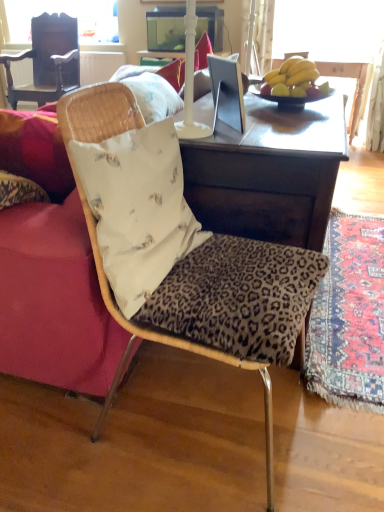
This screenshot has width=384, height=512. In order to click on leopard print fabric chair at center, the 2th chair viewed from the back in this screenshot , I will do `click(98, 243)`.

What is the approximate width of yellow matte bananas at upper right?

10.57 inches.

Where is `leopard print fabric chair at center, which ranks as the 2th chair in top-to-bottom order`? The width and height of the screenshot is (384, 512). leopard print fabric chair at center, which ranks as the 2th chair in top-to-bottom order is located at coordinates (98, 243).

Measure the distance from velvet red couch at left to leopard print fabric chair at center, which ranks as the first chair in right-to-left order.

velvet red couch at left and leopard print fabric chair at center, which ranks as the first chair in right-to-left order, are 9.75 inches apart.

Does velvet red couch at left come in front of leopard print fabric chair at center, which ranks as the 2th chair in top-to-bottom order?

No, the depth of velvet red couch at left is greater than that of leopard print fabric chair at center, which ranks as the 2th chair in top-to-bottom order.

Considering the sizes of objects velvet red couch at left and leopard print fabric chair at center, arranged as the 1th chair when viewed from the front, in the image provided, who is shorter, velvet red couch at left or leopard print fabric chair at center, arranged as the 1th chair when viewed from the front,?

With less height is velvet red couch at left.

Consider the image. Measure the distance between velvet red couch at left and carpet with intricate patterns at lower right.

velvet red couch at left and carpet with intricate patterns at lower right are 35.40 inches apart.

Is velvet red couch at left to the left of carpet with intricate patterns at lower right from the viewer's perspective?

Correct, you'll find velvet red couch at left to the left of carpet with intricate patterns at lower right.

Can you confirm if velvet red couch at left is wider than carpet with intricate patterns at lower right?

Yes.

Is velvet red couch at left oriented towards carpet with intricate patterns at lower right?

No, velvet red couch at left is not aimed at carpet with intricate patterns at lower right.

This screenshot has width=384, height=512. I want to click on pillow below the wooden desk at center (from the image's perspective), so click(138, 208).

Consider the image. Who is taller, white fabric pillow at center or wooden desk at center?

With more height is wooden desk at center.

Considering the relative positions of white fabric pillow at center and wooden desk at center in the image provided, is white fabric pillow at center to the right of wooden desk at center from the viewer's perspective?

No.

Looking at the image, does white fabric pillow at center seem bigger or smaller compared to wooden desk at center?

In the image, white fabric pillow at center appears to be smaller than wooden desk at center.

Consider the image. Between leopard print fabric chair at center, marked as the second chair in a left-to-right arrangement, and velvet red couch at left, which one is positioned behind?

Positioned behind is velvet red couch at left.

Is leopard print fabric chair at center, the 2th chair viewed from the back, facing towards velvet red couch at left?

No, leopard print fabric chair at center, the 2th chair viewed from the back, is not aimed at velvet red couch at left.

Between leopard print fabric chair at center, arranged as the 1th chair when viewed from the front, and velvet red couch at left, which one appears on the left side from the viewer's perspective?

Positioned to the left is velvet red couch at left.

What's the angular difference between leopard print fabric chair at center, which ranks as the 2th chair in top-to-bottom order, and velvet red couch at left's facing directions?

The angular difference between leopard print fabric chair at center, which ranks as the 2th chair in top-to-bottom order, and velvet red couch at left is 179 degrees.

Is wooden desk at center facing towards carpet with intricate patterns at lower right?

Yes, wooden desk at center is facing carpet with intricate patterns at lower right.

Does wooden desk at center have a lesser height compared to carpet with intricate patterns at lower right?

In fact, wooden desk at center may be taller than carpet with intricate patterns at lower right.

Considering the relative positions of wooden desk at center and carpet with intricate patterns at lower right in the image provided, is wooden desk at center behind carpet with intricate patterns at lower right?

No, the depth of wooden desk at center is less than that of carpet with intricate patterns at lower right.

Is wooden desk at center with carpet with intricate patterns at lower right?

wooden desk at center and carpet with intricate patterns at lower right are clearly separated.

Which of these two, carpet with intricate patterns at lower right or velvet red couch at left, stands taller?

velvet red couch at left is taller.

Which is correct: carpet with intricate patterns at lower right is inside velvet red couch at left, or outside of it?

carpet with intricate patterns at lower right is not enclosed by velvet red couch at left.

Between carpet with intricate patterns at lower right and velvet red couch at left, which one has smaller size?

carpet with intricate patterns at lower right is smaller.

Is carpet with intricate patterns at lower right aimed at velvet red couch at left?

No, carpet with intricate patterns at lower right is not oriented towards velvet red couch at left.

Can you confirm if yellow matte bananas at upper right is bigger than white fabric pillow at center?

No.

Is yellow matte bananas at upper right at the right side of white fabric pillow at center?

Correct, you'll find yellow matte bananas at upper right to the right of white fabric pillow at center.

From the image's perspective, is yellow matte bananas at upper right on top of white fabric pillow at center?

Yes, from the image's perspective, yellow matte bananas at upper right is over white fabric pillow at center.

Who is shorter, yellow matte bananas at upper right or white fabric pillow at center?

yellow matte bananas at upper right.

This screenshot has height=512, width=384. In order to click on chair in front of the velvet red couch at left in this screenshot , I will do `click(98, 243)`.

This screenshot has width=384, height=512. In order to click on studio couch on the left side of carpet with intricate patterns at lower right in this screenshot , I will do (50, 269).

Based on their spatial positions, is wooden desk at center or velvet red couch at left closer to carpet with intricate patterns at lower right?

wooden desk at center lies closer to carpet with intricate patterns at lower right than the other object.

Estimate the real-world distances between objects in this image. Which object is further from yellow matte bananas at upper right, white fabric pillow at center or velvet red couch at left?

Based on the image, velvet red couch at left appears to be further to yellow matte bananas at upper right.

Considering their positions, is carpet with intricate patterns at lower right positioned closer to velvet red couch at left than wooden desk at center?

wooden desk at center is positioned closer to the anchor velvet red couch at left.

When comparing their distances from leopard print fabric chair at center, which ranks as the 2th chair in top-to-bottom order, does yellow matte bananas at upper right or carpet with intricate patterns at lower right seem further?

Among the two, yellow matte bananas at upper right is located further to leopard print fabric chair at center, which ranks as the 2th chair in top-to-bottom order.

When comparing their distances from yellow matte bananas at upper right, does carpet with intricate patterns at lower right or white fabric pillow at center seem further?

Among the two, carpet with intricate patterns at lower right is located further to yellow matte bananas at upper right.

Looking at this image, estimate the real-world distances between objects in this image. Which object is further from wooden desk at center, yellow matte bananas at upper right or white fabric pillow at center?

yellow matte bananas at upper right lies further to wooden desk at center than the other object.

Considering their positions, is wooden desk at center positioned closer to dark wood chair at upper left, marked as the 2th chair in a front-to-back arrangement, than white fabric pillow at center?

wooden desk at center lies closer to dark wood chair at upper left, marked as the 2th chair in a front-to-back arrangement, than the other object.

Looking at this image, from the image, which object appears to be nearer to dark wood chair at upper left, arranged as the 2th chair when ordered from the bottom, white fabric pillow at center or wooden desk at center?

wooden desk at center is closer to dark wood chair at upper left, arranged as the 2th chair when ordered from the bottom.

Locate an element on the screen. banana positioned between white fabric pillow at center and dark wood chair at upper left, arranged as the 2th chair when ordered from the bottom, from near to far is located at coordinates (291, 78).

The width and height of the screenshot is (384, 512). Identify the location of desk between yellow matte bananas at upper right and carpet with intricate patterns at lower right in the vertical direction. (270, 173).

The width and height of the screenshot is (384, 512). I want to click on banana positioned between velvet red couch at left and dark wood chair at upper left, the first chair from the back, from near to far, so click(x=291, y=78).

The image size is (384, 512). I want to click on pillow between velvet red couch at left and carpet with intricate patterns at lower right, so pyautogui.click(x=138, y=208).